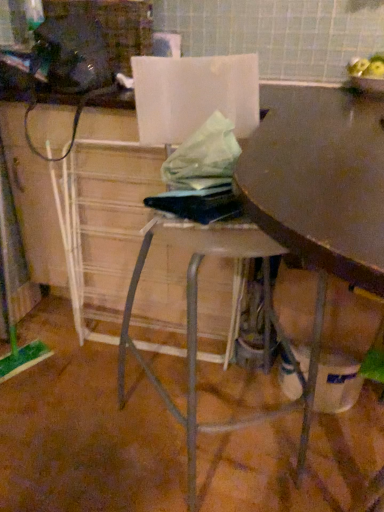
What do you see at coordinates (196, 325) in the screenshot? I see `metallic silver stool at center` at bounding box center [196, 325].

Identify the location of metallic silver stool at center. (196, 325).

You are a GUI agent. You are given a task and a screenshot of the screen. Output one action in this format:
    pyautogui.click(x=<x>, y=<y>)
    Task: Click on the metallic silver stool at center
    This screenshot has height=512, width=384.
    Given the screenshot: What is the action you would take?
    pyautogui.click(x=196, y=325)